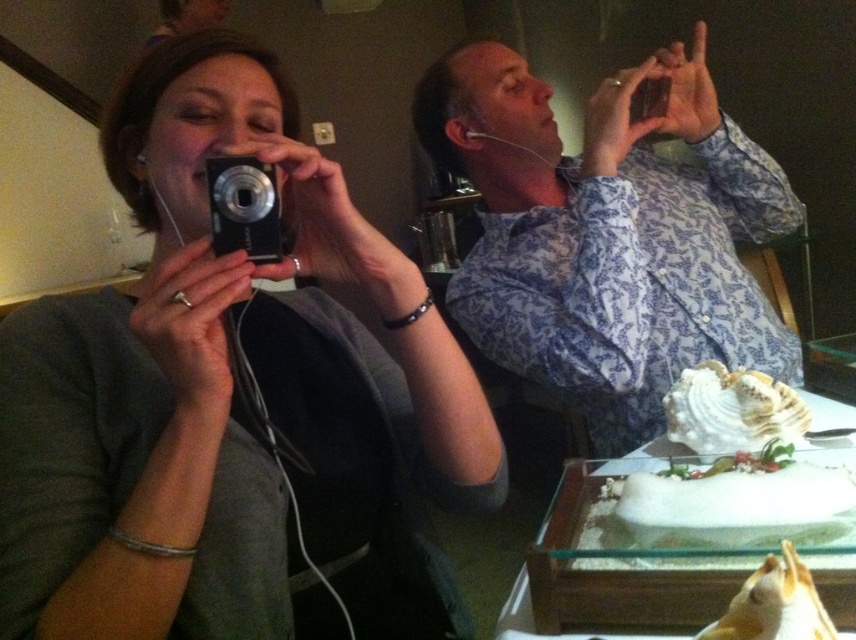
You are a photographer trying to set up a tripod in the scene. The matte black camera at upper left is currently at point 0.625, 0.271. If you want to place the tripod 0.1 units to the right and 0.05 units down from the camera, what are the new coordinates for the tripod?

The new coordinates for the tripod would be (x=188, y=464). This is calculated by adding 0.1 to the original x coordinate of 0.625 and subtracting 0.05 from the original y coordinate of 0.271.

Please look at the scene where two people are taking photos. There is a white frosted cake at center. The coordinates of the cake are point (736, 506). If you were standing at the origin point 0,0, which direction should you move to reach the cake?

The white frosted cake at center is located at point (736, 506), so you should move towards the positive x and positive y direction to reach it from the origin point 0,0.

You are a photographer trying to capture a shot of both the white frosted cake at center and the silver metallic camera at upper center in the same frame. Given that your camera has a maximum focal length allowing objects 15 inches apart to be in focus simultaneously, will you be able to include both subjects clearly in your photo?

The white frosted cake at center and the silver metallic camera at upper center are 17.34 inches apart from each other. Since the maximum focal length allows objects 15 inches apart to be in focus, the distance between them exceeds this limit. Therefore, you won both subjects clearly in your photo.